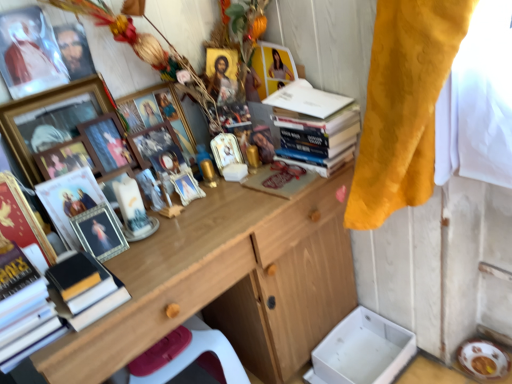
At what (x,y) coordinates should I click in order to perform the action: click on vacant space to the right of matte gold picture frame at left, the first magazine when ordered from left to right. Please return your answer as a coordinate pair (x, y). This screenshot has width=512, height=384. Looking at the image, I should click on point(164,233).